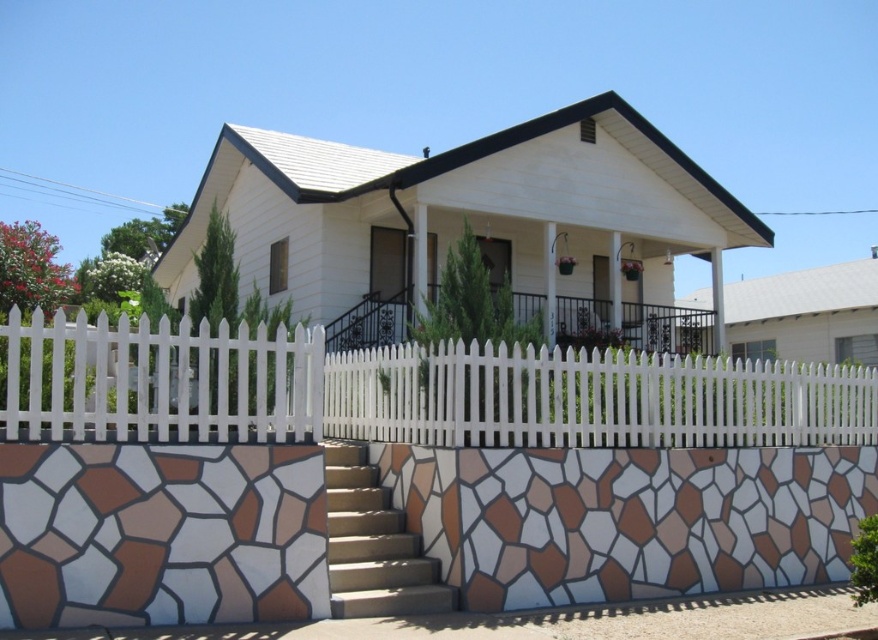
Question: Which object is positioned closest to the white picket fence at left?

Choices:
 (A) white picket fence at center
 (B) white picket fence at lower center

Answer: (B)

Question: Which point is closer to the camera taking this photo?

Choices:
 (A) (x=228, y=353)
 (B) (x=848, y=406)

Answer: (A)

Question: Is white picket fence at lower center smaller than brown stone stairs at lower left?

Choices:
 (A) yes
 (B) no

Answer: (B)

Question: In this image, where is white picket fence at lower center located relative to white picket fence at center?

Choices:
 (A) right
 (B) left

Answer: (B)

Question: Considering the relative positions of white picket fence at center and white picket fence at left in the image provided, where is white picket fence at center located with respect to white picket fence at left?

Choices:
 (A) left
 (B) right

Answer: (B)

Question: Among these objects, which one is farthest from the camera?

Choices:
 (A) white picket fence at center
 (B) white picket fence at lower center

Answer: (A)